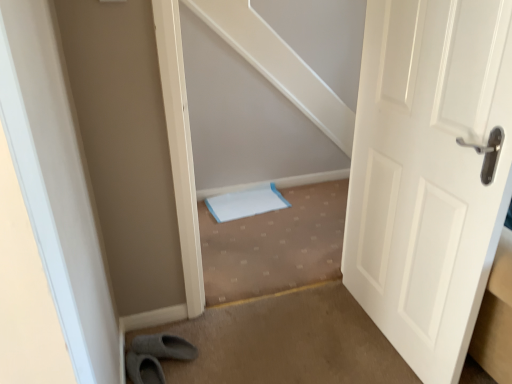
Locate an element on the screen. This screenshot has width=512, height=384. vacant space situated above carpeted stairwell at center (from a real-world perspective) is located at coordinates (279, 267).